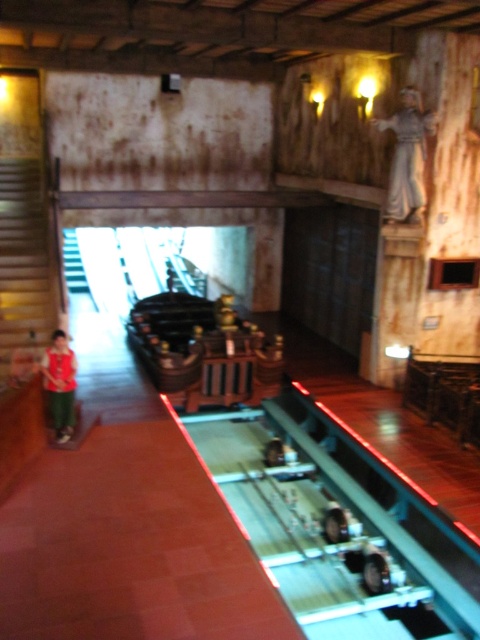
Can you confirm if wooden staircase at left is positioned above white marble statue at upper right?

No, wooden staircase at left is not above white marble statue at upper right.

At what (x,y) coordinates should I click in order to perform the action: click on wooden staircase at left. Please return your answer as a coordinate pair (x, y). The height and width of the screenshot is (640, 480). Looking at the image, I should click on (24, 262).

Who is lower down, white marble statue at upper right or matte red shirt at left?

matte red shirt at left is lower down.

Can you confirm if white marble statue at upper right is positioned to the left of matte red shirt at left?

No, white marble statue at upper right is not to the left of matte red shirt at left.

Image resolution: width=480 pixels, height=640 pixels. I want to click on white marble statue at upper right, so click(408, 156).

Which is below, wooden staircase at left or matte red shirt at left?

matte red shirt at left

Between point (48, 332) and point (72, 362), which one is positioned behind?

Positioned behind is point (48, 332).

Is point (44, 184) closer to camera compared to point (49, 365)?

That is False.

Locate an element on the screen. Image resolution: width=480 pixels, height=640 pixels. wooden staircase at left is located at coordinates (24, 262).